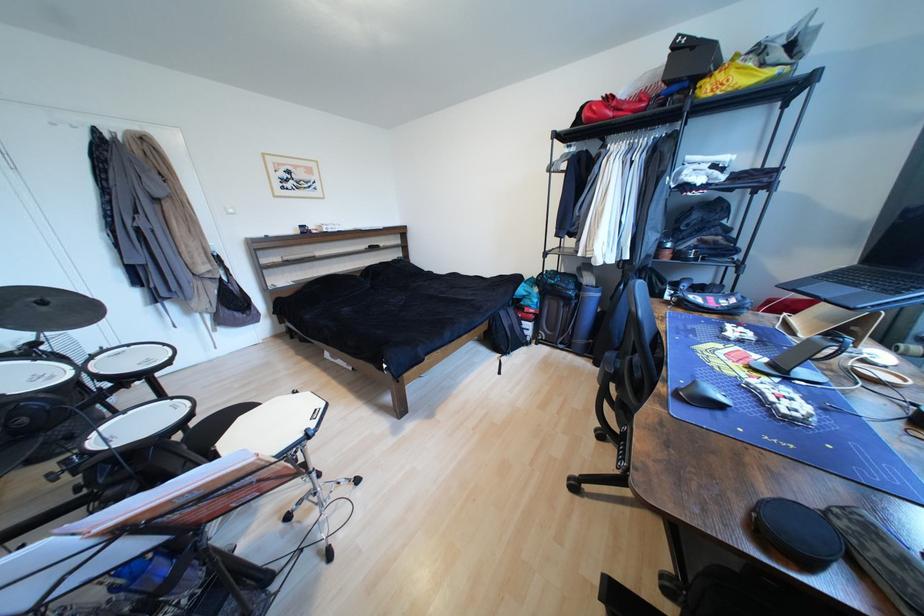
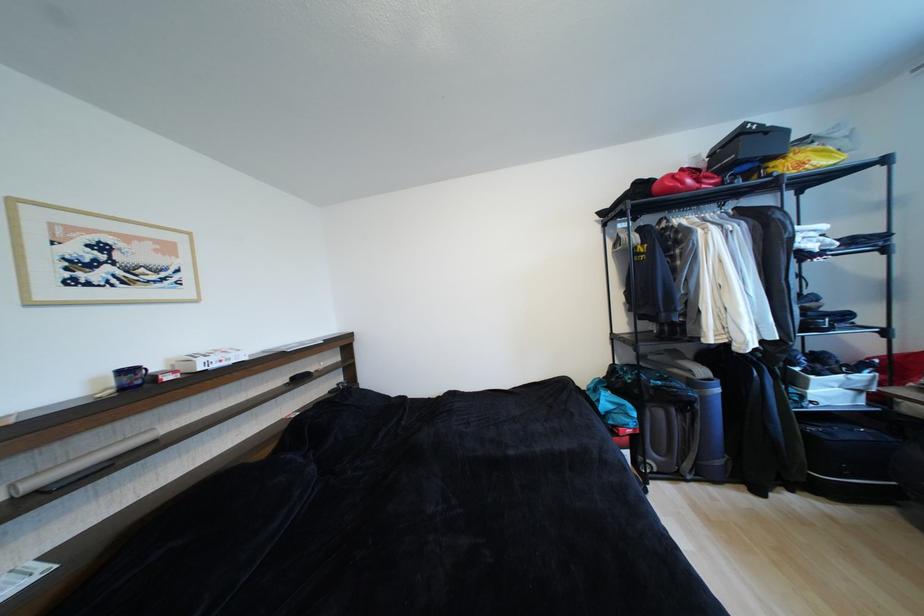
In the second image, find the point that corresponds to [706,84] in the first image.

(780, 166)